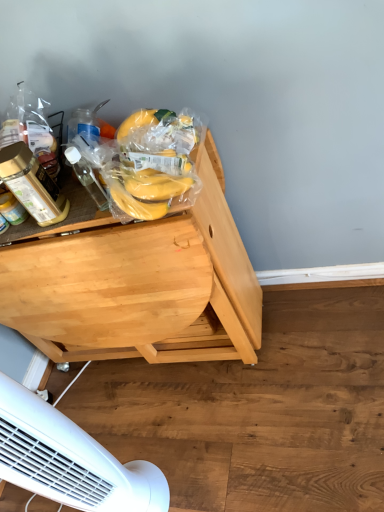
Locate an element on the screen. The image size is (384, 512). light wood desk at center is located at coordinates (140, 287).

Locate an element on the screen. The width and height of the screenshot is (384, 512). yellow matte bananas at upper left, which is the 1th food from top to bottom is located at coordinates (140, 167).

Find the location of a particular element. The width and height of the screenshot is (384, 512). transparent plastic bottle at left, which is counted as the 1th bottle, starting from the right is located at coordinates click(87, 177).

From the image's perspective, would you say yellow matte bananas at upper left, placed as the 2th food when sorted from bottom to top, is positioned over transparent plastic bottle at left, which is counted as the 1th bottle, starting from the right?

Yes, from the image's perspective, yellow matte bananas at upper left, placed as the 2th food when sorted from bottom to top, is above transparent plastic bottle at left, which is counted as the 1th bottle, starting from the right.

Is yellow matte bananas at upper left, placed as the 2th food when sorted from bottom to top, inside the boundaries of transparent plastic bottle at left, which is counted as the 1th bottle, starting from the right, or outside?

yellow matte bananas at upper left, placed as the 2th food when sorted from bottom to top, is spatially situated outside transparent plastic bottle at left, which is counted as the 1th bottle, starting from the right.

Who is more distant, yellow matte bananas at upper left, which is the 1th food from top to bottom, or transparent plastic bottle at left, which is counted as the second bottle, starting from the left?

yellow matte bananas at upper left, which is the 1th food from top to bottom.

From a real-world perspective, does yellow matte bananas at upper left, placed as the 2th food when sorted from bottom to top, stand above transparent plastic bottle at left, which is counted as the second bottle, starting from the left?

No, from a real-world perspective, yellow matte bananas at upper left, placed as the 2th food when sorted from bottom to top, is not on top of transparent plastic bottle at left, which is counted as the second bottle, starting from the left.

Can you confirm if yellow matte bananas at center, the 2th food in the top-to-bottom sequence, is smaller than yellow matte bananas at upper left, placed as the 2th food when sorted from bottom to top?

Indeed, yellow matte bananas at center, the 2th food in the top-to-bottom sequence, has a smaller size compared to yellow matte bananas at upper left, placed as the 2th food when sorted from bottom to top.

Considering the sizes of yellow matte bananas at center, which is counted as the 1th food, starting from the bottom, and yellow matte bananas at upper left, which is the 1th food from top to bottom, in the image, is yellow matte bananas at center, which is counted as the 1th food, starting from the bottom, taller or shorter than yellow matte bananas at upper left, which is the 1th food from top to bottom,?

In the image, yellow matte bananas at center, which is counted as the 1th food, starting from the bottom, appears to be shorter than yellow matte bananas at upper left, which is the 1th food from top to bottom.

Would you say yellow matte bananas at center, the 2th food in the top-to-bottom sequence, is to the left or to the right of yellow matte bananas at upper left, which is the 1th food from top to bottom, in the picture?

Clearly, yellow matte bananas at center, the 2th food in the top-to-bottom sequence, is on the right of yellow matte bananas at upper left, which is the 1th food from top to bottom, in the image.

From the image's perspective, between yellow matte bananas at center, which is counted as the 1th food, starting from the bottom, and yellow matte bananas at upper left, which is the 1th food from top to bottom, who is located below?

yellow matte bananas at center, which is counted as the 1th food, starting from the bottom.

Are yellow matte bananas at upper left, which is the 1th food from top to bottom, and light wood desk at center far apart?

No, yellow matte bananas at upper left, which is the 1th food from top to bottom, is not far away from light wood desk at center.

Identify the location of the 2nd food above when counting from the light wood desk at center (from the image's perspective). This screenshot has width=384, height=512. (140, 167).

Is transparent plastic bottle at left, which is counted as the 1th bottle, starting from the right, not inside yellow matte bananas at center, the 2th food in the top-to-bottom sequence?

Indeed, transparent plastic bottle at left, which is counted as the 1th bottle, starting from the right, is completely outside yellow matte bananas at center, the 2th food in the top-to-bottom sequence.

Is point (68, 156) less distant than point (143, 182)?

No.

Identify the location of food in front of the transparent plastic bottle at left, which is counted as the second bottle, starting from the left. (153, 166).

Is transparent plastic bottle at left, which is counted as the 1th bottle, starting from the right, touching yellow matte bananas at center, the 2th food in the top-to-bottom sequence?

No, transparent plastic bottle at left, which is counted as the 1th bottle, starting from the right, is not in contact with yellow matte bananas at center, the 2th food in the top-to-bottom sequence.

Which point is more forward, (x=111, y=501) or (x=24, y=147)?

The point (x=24, y=147) is in front.

In terms of width, does white plastic mechanical fan at lower left look wider or thinner when compared to translucent plastic bottle at left, which appears as the 1th bottle when viewed from the left?

In the image, white plastic mechanical fan at lower left appears to be wider than translucent plastic bottle at left, which appears as the 1th bottle when viewed from the left.

Would you say white plastic mechanical fan at lower left is inside or outside translucent plastic bottle at left, the second bottle in the right-to-left sequence?

white plastic mechanical fan at lower left is not enclosed by translucent plastic bottle at left, the second bottle in the right-to-left sequence.

In the scene shown: In the image, is white plastic mechanical fan at lower left positioned in front of or behind translucent plastic bottle at left, the second bottle in the right-to-left sequence?

white plastic mechanical fan at lower left is in front of translucent plastic bottle at left, the second bottle in the right-to-left sequence.

Measure the distance between light wood desk at center and yellow matte bananas at upper left, placed as the 2th food when sorted from bottom to top.

The distance of light wood desk at center from yellow matte bananas at upper left, placed as the 2th food when sorted from bottom to top, is 9.99 inches.

Is point (83, 272) positioned after point (95, 146)?

Yes, point (83, 272) is farther from viewer.

Find the location of `desk below the yellow matte bananas at upper left, placed as the 2th food when sorted from bottom to top (from a real-world perspective)`. desk below the yellow matte bananas at upper left, placed as the 2th food when sorted from bottom to top (from a real-world perspective) is located at coordinates (140, 287).

From the image's perspective, is light wood desk at center located beneath yellow matte bananas at upper left, which is the 1th food from top to bottom?

Yes.

Who is smaller, white plastic mechanical fan at lower left or transparent plastic bottle at left, which is counted as the 1th bottle, starting from the right?

transparent plastic bottle at left, which is counted as the 1th bottle, starting from the right.

Is white plastic mechanical fan at lower left wider than transparent plastic bottle at left, which is counted as the 1th bottle, starting from the right?

Correct, the width of white plastic mechanical fan at lower left exceeds that of transparent plastic bottle at left, which is counted as the 1th bottle, starting from the right.

What's the angular difference between white plastic mechanical fan at lower left and transparent plastic bottle at left, which is counted as the second bottle, starting from the left,'s facing directions?

There is a 34.7-degree angle between the facing directions of white plastic mechanical fan at lower left and transparent plastic bottle at left, which is counted as the second bottle, starting from the left.

Is transparent plastic bottle at left, which is counted as the second bottle, starting from the left, located within white plastic mechanical fan at lower left?

No, white plastic mechanical fan at lower left does not contain transparent plastic bottle at left, which is counted as the second bottle, starting from the left.

From the yellow matte bananas at upper left, placed as the 2th food when sorted from bottom to top, count 2nd bottles forward and point to it. Please provide its 2D coordinates.

[(87, 177)]

Locate an element on the screen. food that is on the right side of yellow matte bananas at upper left, placed as the 2th food when sorted from bottom to top is located at coordinates (153, 166).

Looking at the image, which one is located closer to transparent plastic bottle at left, which is counted as the 1th bottle, starting from the right, yellow matte bananas at center, the 2th food in the top-to-bottom sequence, or yellow matte bananas at upper left, which is the 1th food from top to bottom?

yellow matte bananas at upper left, which is the 1th food from top to bottom, lies closer to transparent plastic bottle at left, which is counted as the 1th bottle, starting from the right, than the other object.

Considering their positions, is transparent plastic bottle at left, which is counted as the second bottle, starting from the left, positioned closer to translucent plastic bottle at left, which appears as the 1th bottle when viewed from the left, than light wood desk at center?

Based on the image, transparent plastic bottle at left, which is counted as the second bottle, starting from the left, appears to be nearer to translucent plastic bottle at left, which appears as the 1th bottle when viewed from the left.

Consider the image. Based on their spatial positions, is translucent plastic bottle at left, the second bottle in the right-to-left sequence, or yellow matte bananas at upper left, which is the 1th food from top to bottom, closer to light wood desk at center?

The object closer to light wood desk at center is yellow matte bananas at upper left, which is the 1th food from top to bottom.

Considering their positions, is white plastic mechanical fan at lower left positioned closer to transparent plastic bottle at left, which is counted as the second bottle, starting from the left, than yellow matte bananas at upper left, placed as the 2th food when sorted from bottom to top?

Among the two, yellow matte bananas at upper left, placed as the 2th food when sorted from bottom to top, is located nearer to transparent plastic bottle at left, which is counted as the second bottle, starting from the left.

When comparing their distances from white plastic mechanical fan at lower left, does light wood desk at center or transparent plastic bottle at left, which is counted as the second bottle, starting from the left, seem further?

transparent plastic bottle at left, which is counted as the second bottle, starting from the left, is further to white plastic mechanical fan at lower left.

Estimate the real-world distances between objects in this image. Which object is further from yellow matte bananas at center, which is counted as the 1th food, starting from the bottom, transparent plastic bottle at left, which is counted as the second bottle, starting from the left, or white plastic mechanical fan at lower left?

white plastic mechanical fan at lower left.

Which object lies further to the anchor point transparent plastic bottle at left, which is counted as the 1th bottle, starting from the right, white plastic mechanical fan at lower left or yellow matte bananas at center, which is counted as the 1th food, starting from the bottom?

white plastic mechanical fan at lower left.

Looking at the image, which one is located further to translucent plastic bottle at left, the second bottle in the right-to-left sequence, yellow matte bananas at upper left, placed as the 2th food when sorted from bottom to top, or transparent plastic bottle at left, which is counted as the second bottle, starting from the left?

yellow matte bananas at upper left, placed as the 2th food when sorted from bottom to top, lies further to translucent plastic bottle at left, the second bottle in the right-to-left sequence, than the other object.

Where is `food between translucent plastic bottle at left, which appears as the 1th bottle when viewed from the left, and yellow matte bananas at center, which is counted as the 1th food, starting from the bottom, in the horizontal direction`? The width and height of the screenshot is (384, 512). food between translucent plastic bottle at left, which appears as the 1th bottle when viewed from the left, and yellow matte bananas at center, which is counted as the 1th food, starting from the bottom, in the horizontal direction is located at coordinates (140, 167).

Find the location of a particular element. The width and height of the screenshot is (384, 512). bottle between translucent plastic bottle at left, which appears as the 1th bottle when viewed from the left, and yellow matte bananas at center, which is counted as the 1th food, starting from the bottom is located at coordinates (87, 177).

At what (x,y) coordinates should I click in order to perform the action: click on desk between transparent plastic bottle at left, which is counted as the 1th bottle, starting from the right, and white plastic mechanical fan at lower left from top to bottom. Please return your answer as a coordinate pair (x, y). Looking at the image, I should click on (x=140, y=287).

Locate an element on the screen. The image size is (384, 512). food between transparent plastic bottle at left, which is counted as the 1th bottle, starting from the right, and white plastic mechanical fan at lower left, in the vertical direction is located at coordinates (153, 166).